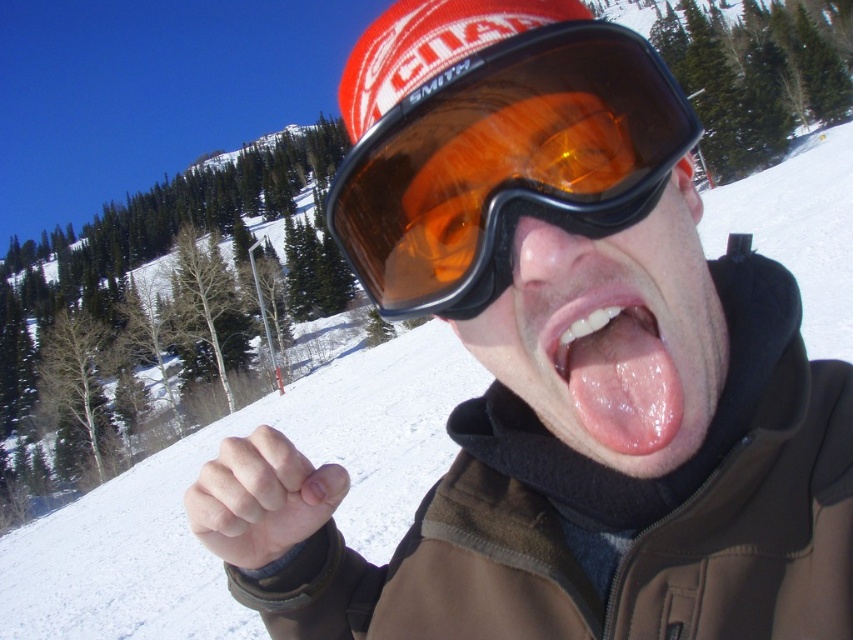
Based on the photo, does orange tinted plastic goggles at center appear under pink smooth tongue at center?

No, orange tinted plastic goggles at center is not below pink smooth tongue at center.

Which of these two, orange tinted plastic goggles at center or pink smooth tongue at center, stands taller?

orange tinted plastic goggles at center

Locate an element on the screen. orange tinted plastic goggles at center is located at coordinates (506, 163).

The image size is (853, 640). I want to click on orange tinted plastic goggles at center, so click(x=506, y=163).

Is point (486, 285) behind point (641, 388)?

That is True.

Which is more to the left, orange tinted plastic goggles at center or matte black goggles at center?

orange tinted plastic goggles at center

Does point (424, 244) come in front of point (648, 321)?

No, (424, 244) is behind (648, 321).

The height and width of the screenshot is (640, 853). Identify the location of orange tinted plastic goggles at center. (x=506, y=163).

Describe the element at coordinates (612, 336) in the screenshot. Image resolution: width=853 pixels, height=640 pixels. I see `matte black goggles at center` at that location.

Based on the photo, is matte black goggles at center to the left of pink smooth tongue at center from the viewer's perspective?

In fact, matte black goggles at center is to the right of pink smooth tongue at center.

This screenshot has width=853, height=640. I want to click on matte black goggles at center, so click(x=612, y=336).